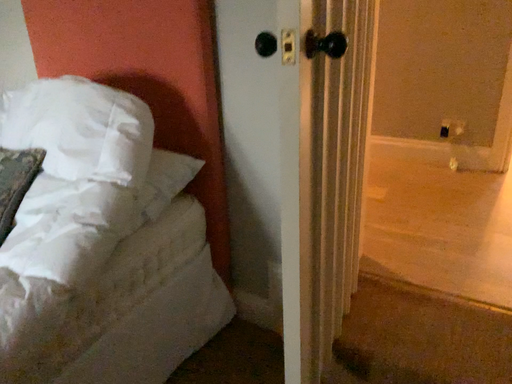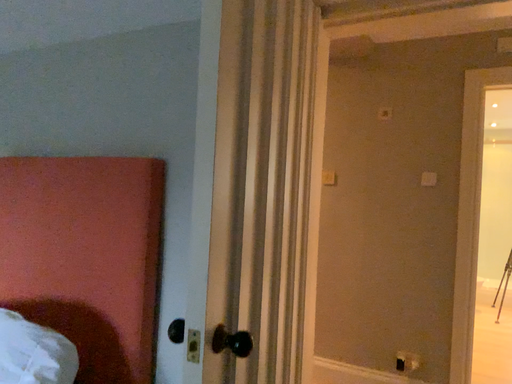
Question: How did the camera likely rotate when shooting the video?

Choices:
 (A) rotated downward
 (B) rotated upward

Answer: (B)